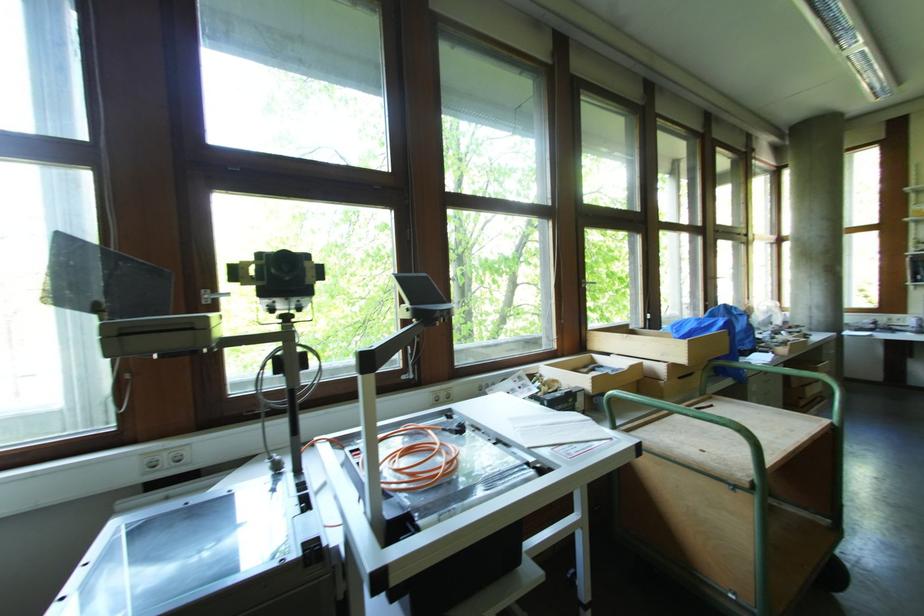
The width and height of the screenshot is (924, 616). In order to click on green cart handle in this screenshot , I will do `click(794, 382)`.